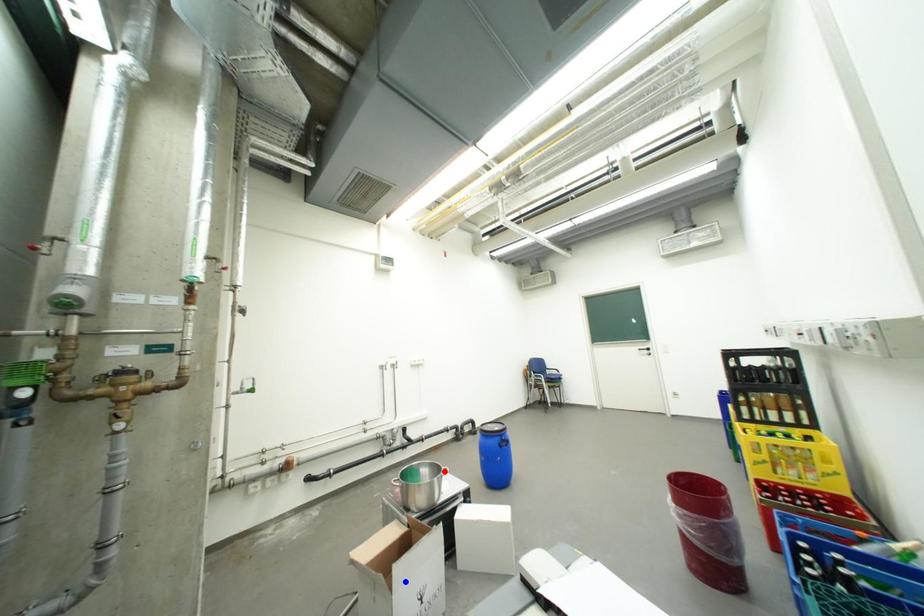
Question: In the image, two points are highlighted. Which point is nearer to the camera? Reply with the corresponding letter.

Choices:
 (A) blue point
 (B) red point

Answer: (A)